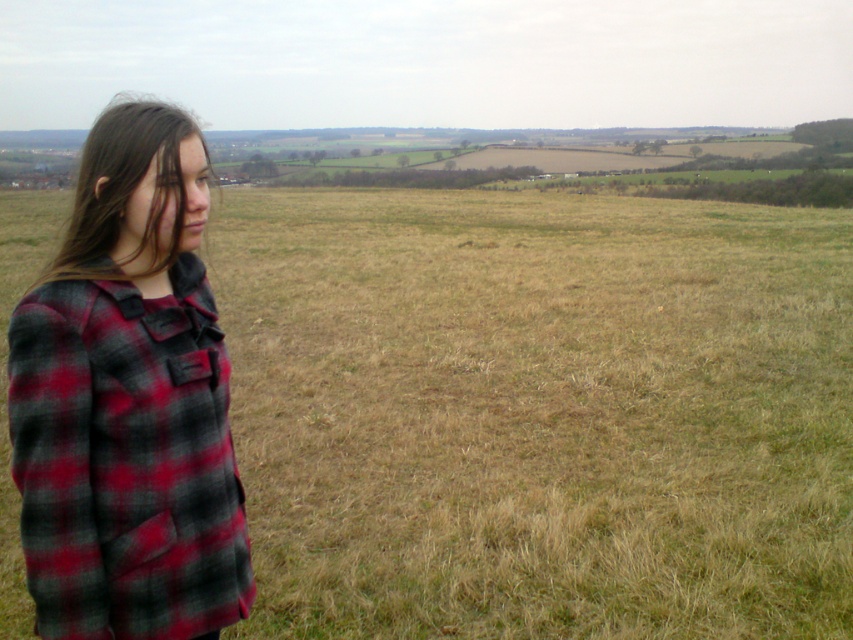
You are a photographer trying to capture a closeup of the brown dry grass at left and the red plaid jacket at left. Since you want both subjects to be clearly visible in the frame, which object should you focus on to ensure the wider subject is in focus?

The brown dry grass at left has a larger width than the red plaid jacket at left, so you should focus on the brown dry grass at left to ensure the wider subject is in focus.

You are standing at the center of the field and see the point marked as point (x=538, y=412). What is the color of the grass at that location?

The grass at point (x=538, y=412) is brown dry grass at left.

You are a photographer trying to capture the person in the scene. You notice the brown dry grass at left and the red plaid jacket at left. Which object is taller and might obstruct the view of the person if you position yourself behind them?

The brown dry grass at left is taller than the red plaid jacket at left, so it might obstruct the view of the person if you position yourself behind them.